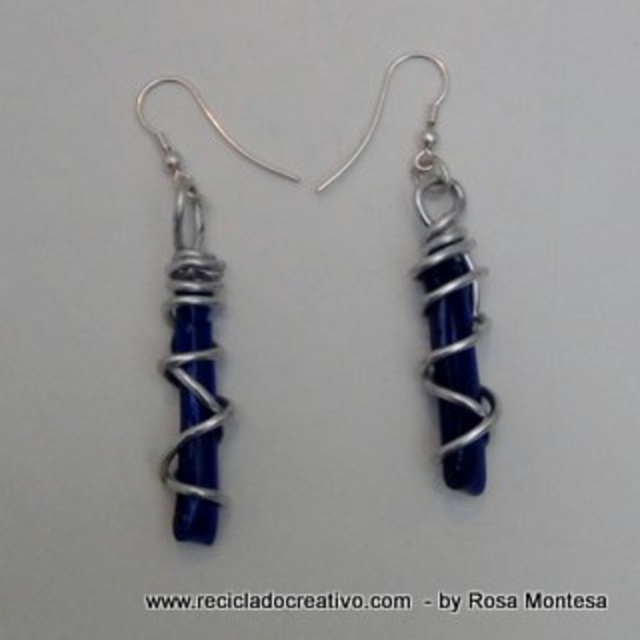
Question: Is satin blue stone at center to the left of blue glass stone at left from the viewer's perspective?

Choices:
 (A) yes
 (B) no

Answer: (B)

Question: Is satin blue stone at center further to the viewer compared to blue glass stone at left?

Choices:
 (A) yes
 (B) no

Answer: (A)

Question: Does satin blue stone at center lie behind blue glass stone at left?

Choices:
 (A) yes
 (B) no

Answer: (A)

Question: Which point is farther to the camera?

Choices:
 (A) (193, 493)
 (B) (451, 483)

Answer: (B)

Question: Among these points, which one is farthest from the camera?

Choices:
 (A) (444, 362)
 (B) (177, 202)

Answer: (B)